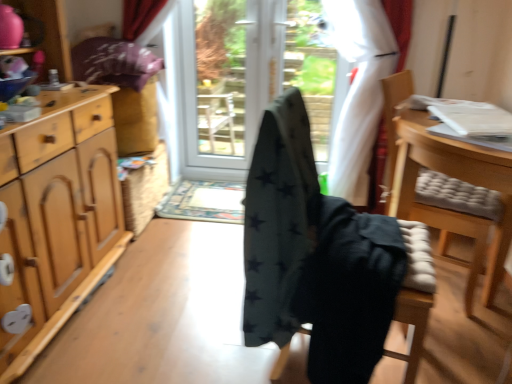
Question: Which direction should I rotate to look at dark gray fabric chair at center, which is the first chair from left to right, — up or down?

Choices:
 (A) down
 (B) up

Answer: (A)

Question: Is the position of black fabric screen door at center, which is the first screen door from right to left, less distant than that of white glossy screen door at center, which is the second screen door from right to left?

Choices:
 (A) yes
 (B) no

Answer: (A)

Question: Does black fabric screen door at center, which is the first screen door from right to left, appear on the right side of white glossy screen door at center, which is the second screen door from right to left?

Choices:
 (A) yes
 (B) no

Answer: (A)

Question: Considering the relative sizes of black fabric screen door at center, arranged as the 2th screen door when viewed from the left, and white glossy screen door at center, which is the second screen door from right to left, in the image provided, is black fabric screen door at center, arranged as the 2th screen door when viewed from the left, wider than white glossy screen door at center, which is the second screen door from right to left,?

Choices:
 (A) no
 (B) yes

Answer: (A)

Question: Can you confirm if black fabric screen door at center, arranged as the 2th screen door when viewed from the left, is thinner than white glossy screen door at center, which is the second screen door from right to left?

Choices:
 (A) no
 (B) yes

Answer: (B)

Question: From the image's perspective, is black fabric screen door at center, arranged as the 2th screen door when viewed from the left, above white glossy screen door at center, which is the 1th screen door from left to right?

Choices:
 (A) no
 (B) yes

Answer: (A)

Question: From a real-world perspective, does black fabric screen door at center, which is the first screen door from right to left, stand above white glossy screen door at center, which is the 1th screen door from left to right?

Choices:
 (A) yes
 (B) no

Answer: (B)

Question: Considering the relative sizes of light wood cabinet at left and white glossy screen door at center, which is the second screen door from right to left, in the image provided, is light wood cabinet at left shorter than white glossy screen door at center, which is the second screen door from right to left,?

Choices:
 (A) yes
 (B) no

Answer: (B)

Question: From a real-world perspective, is light wood cabinet at left below white glossy screen door at center, which is the 1th screen door from left to right?

Choices:
 (A) yes
 (B) no

Answer: (A)

Question: Considering the relative sizes of light wood cabinet at left and white glossy screen door at center, which is the second screen door from right to left, in the image provided, is light wood cabinet at left smaller than white glossy screen door at center, which is the second screen door from right to left,?

Choices:
 (A) yes
 (B) no

Answer: (B)

Question: Is light wood cabinet at left facing away from white glossy screen door at center, which is the second screen door from right to left?

Choices:
 (A) yes
 (B) no

Answer: (B)

Question: Does light wood cabinet at left come behind white glossy screen door at center, which is the second screen door from right to left?

Choices:
 (A) no
 (B) yes

Answer: (A)

Question: From the image's perspective, does light wood cabinet at left appear lower than white glossy screen door at center, which is the 1th screen door from left to right?

Choices:
 (A) no
 (B) yes

Answer: (B)

Question: Does dark green fabric chair at center, positioned as the 2th chair in right-to-left order, touch light wood cabinet at left?

Choices:
 (A) no
 (B) yes

Answer: (A)